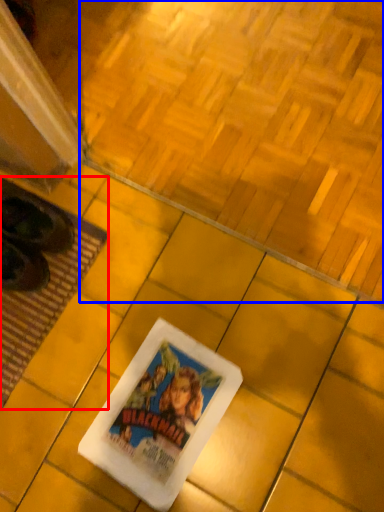
Question: Which point is closer to the camera, mat (highlighted by a red box) or square (highlighted by a blue box)?

Choices:
 (A) mat
 (B) square

Answer: (B)